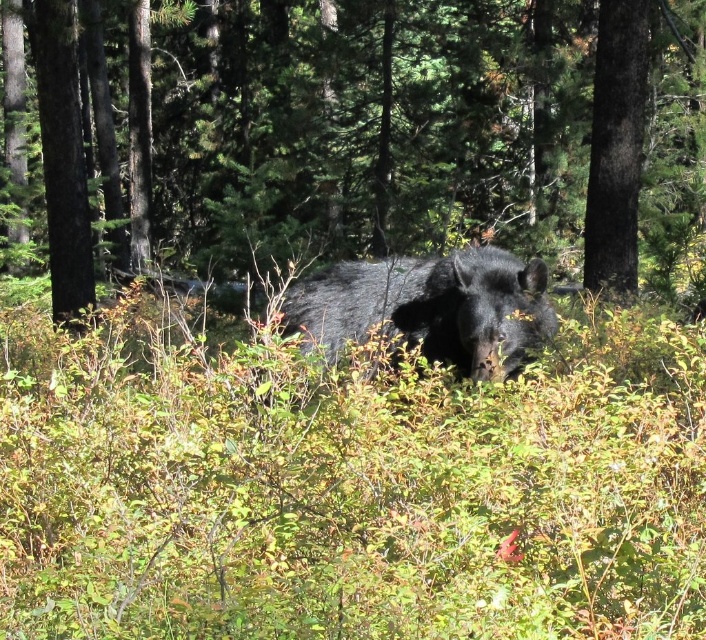
You are an explorer navigating through the forest and need to locate a specific point marked at coordinates (369, 125). Which object in the scene corresponds to this exact location?

The brown textured tree trunk at center is located at point (369, 125).

From the picture: You are an observer in the forest and see the brown textured tree trunk at center and the shiny black bear at center. Which object is positioned to the left?

The brown textured tree trunk at center is positioned to the left of the shiny black bear at center.

You are observing a forest scene with a black bear hidden in the undergrowth. You notice two points marked in the image. The first point is at coordinates point (503, 372), and the second point is at coordinates point (598, 35). Which of these two points is nearer to you as the observer?

Point (503, 372) is closer to the viewer than point (598, 35).